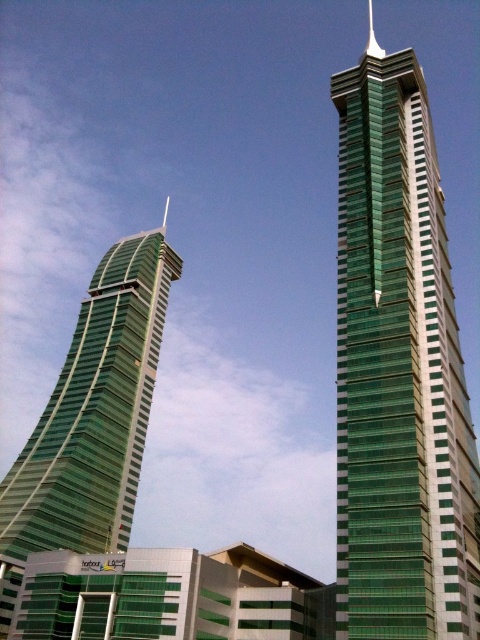
Question: Can you confirm if green glass tower at center is positioned below green glass tower at left?

Choices:
 (A) no
 (B) yes

Answer: (B)

Question: Which is nearer to the green glass tower at left?

Choices:
 (A) green glass tower at center
 (B) green glass spire at upper center

Answer: (A)

Question: From the image, what is the correct spatial relationship of green glass tower at center in relation to green glass tower at left?

Choices:
 (A) left
 (B) right

Answer: (B)

Question: Which of the following is the closest to the observer?

Choices:
 (A) (12, 496)
 (B) (458, 451)
 (C) (371, 36)

Answer: (B)

Question: Is green glass tower at left to the left of green glass spire at upper center from the viewer's perspective?

Choices:
 (A) no
 (B) yes

Answer: (B)

Question: Which of these objects is positioned closest to the green glass spire at upper center?

Choices:
 (A) green glass tower at center
 (B) green glass tower at left

Answer: (A)